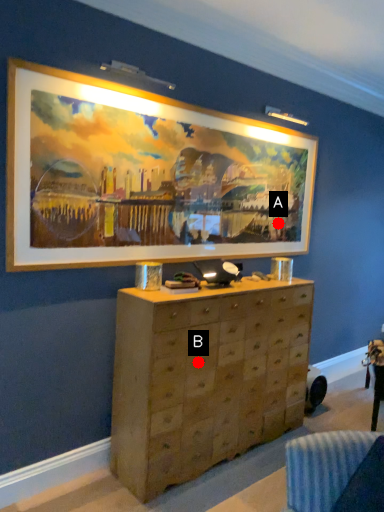
Question: Two points are circled on the image, labeled by A and B beside each circle. Which point is farther from the camera taking this photo?

Choices:
 (A) A is further
 (B) B is further

Answer: (A)